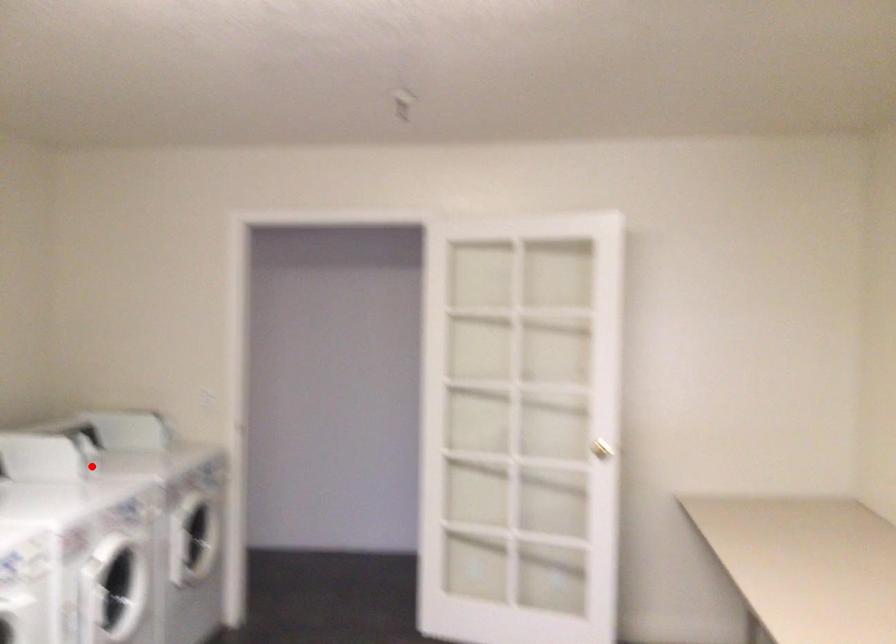
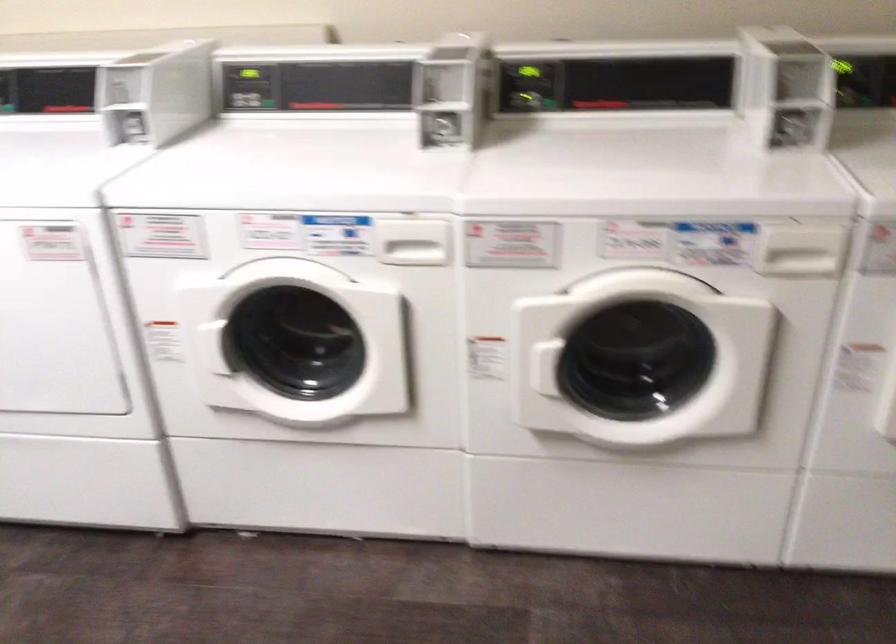
Find the pixel in the second image that matches the highlighted location in the first image.

(798, 129)